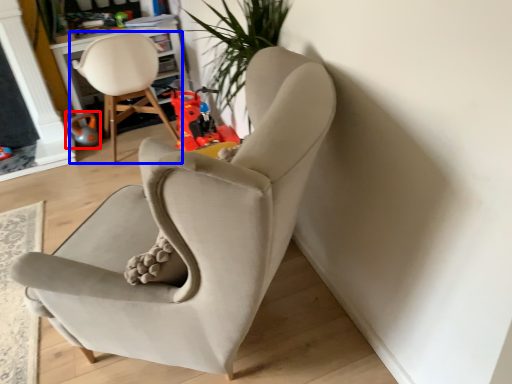
Question: Which object appears farthest to the camera in this image, toy (highlighted by a red box) or chair (highlighted by a blue box)?

Choices:
 (A) toy
 (B) chair

Answer: (A)